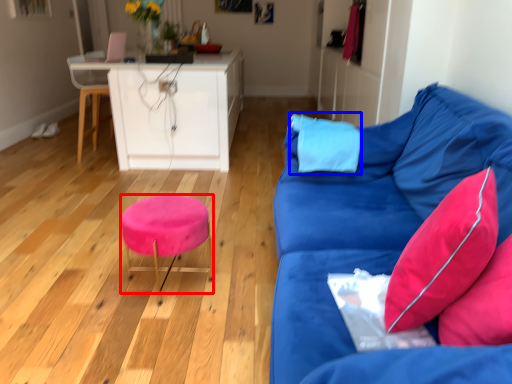
Question: Among these objects, which one is farthest to the camera, stool (highlighted by a red box) or pillow (highlighted by a blue box)?

Choices:
 (A) stool
 (B) pillow

Answer: (B)